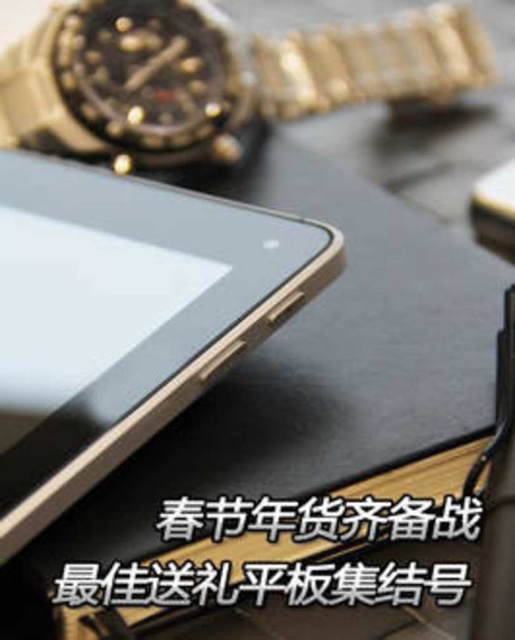
You are a photographer trying to capture a clear shot of the gold metallic tablet at upper left. The camera you are using has a maximum focus range of 65 centimeters. Based on the scene, will the tablet be in focus?

The gold metallic tablet at upper left is 66.23 centimeters away from the camera, which exceeds the maximum focus range of 65 centimeters. Therefore, the tablet will not be in focus.

You are organizing a display for a tech store. You have a gold metallic tablet at upper left and a gold metallic watch at upper left. Which item should you place first if you want to prioritize larger items in the showcase?

You should place the gold metallic tablet at upper left first because it is larger than the gold metallic watch at upper left according to the description.

You are trying to place a small sticker on the surface between the gold metallic tablet at upper left and the gold metallic watch at upper left. Which object is taller so you can position the sticker accordingly?

The gold metallic tablet at upper left is taller than the gold metallic watch at upper left, so position the sticker below the tablet to ensure it fits between them.